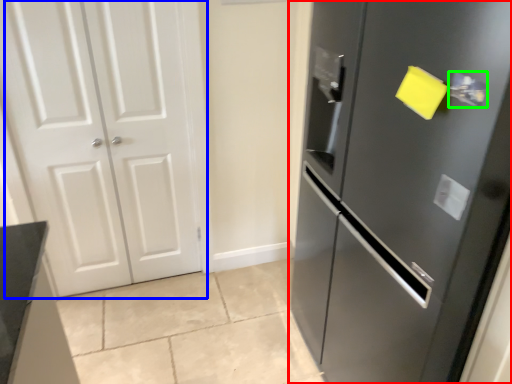
Question: Estimate the real-world distances between objects in this image. Which object is farther from door (highlighted by a red box), door (highlighted by a blue box) or door handle (highlighted by a green box)?

Choices:
 (A) door
 (B) door handle

Answer: (A)